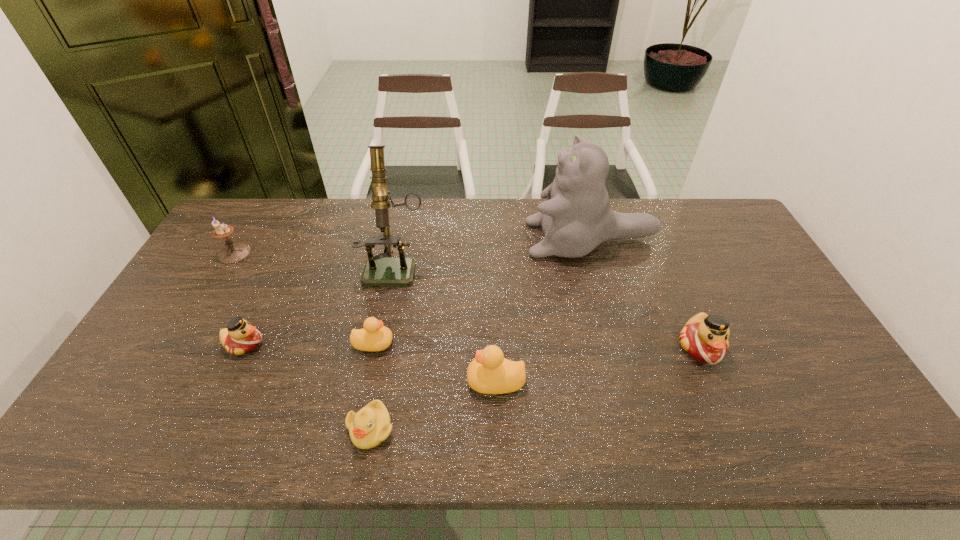
At what (x,y) coordinates should I click in order to perform the action: click on unoccupied position between the leftmost duck and the green cat. Please return your answer as a coordinate pair (x, y). The width and height of the screenshot is (960, 540). Looking at the image, I should click on (418, 292).

The height and width of the screenshot is (540, 960). I want to click on free spot between the farther yellow duck and the nearer yellow duck, so click(435, 362).

At what (x,y) coordinates should I click in order to perform the action: click on the closest object to the bigger red duck. Please return your answer as a coordinate pair (x, y). Looking at the image, I should click on [x=576, y=217].

Identify which object is located as the second nearest to the right red duck. Please provide its 2D coordinates. Your answer should be formatted as a tuple, i.e. [(x, y)], where the tuple contains the x and y coordinates of a point satisfying the conditions above.

[(489, 373)]

Locate an element on the screen. This screenshot has width=960, height=540. the third closest duck to the leftmost object is located at coordinates (489, 373).

Identify which duck is located as the nearest to the rightmost duck. Please provide its 2D coordinates. Your answer should be formatted as a tuple, i.e. [(x, y)], where the tuple contains the x and y coordinates of a point satisfying the conditions above.

[(489, 373)]

Find the location of `vacant space that satisfies the following two spatial constraints: 1. on the face of the rightmost duck; 2. on the face of the sixth object from left to right`. vacant space that satisfies the following two spatial constraints: 1. on the face of the rightmost duck; 2. on the face of the sixth object from left to right is located at coordinates (715, 381).

At what (x,y) coordinates should I click in order to perform the action: click on vacant region that satisfies the following two spatial constraints: 1. on the face of the rightmost duck; 2. on the face of the sixth object from left to right. Please return your answer as a coordinate pair (x, y). Image resolution: width=960 pixels, height=540 pixels. Looking at the image, I should click on (715, 381).

Locate an element on the screen. The width and height of the screenshot is (960, 540). vacant region that satisfies the following two spatial constraints: 1. at the eyepiece of the microscope; 2. on the face of the seventh object from right to left is located at coordinates (381, 344).

At what (x,y) coordinates should I click in order to perform the action: click on free space that satisfies the following two spatial constraints: 1. at the eyepiece of the brown microscope; 2. on the face of the seventh object from right to left. Please return your answer as a coordinate pair (x, y). This screenshot has width=960, height=540. Looking at the image, I should click on (381, 344).